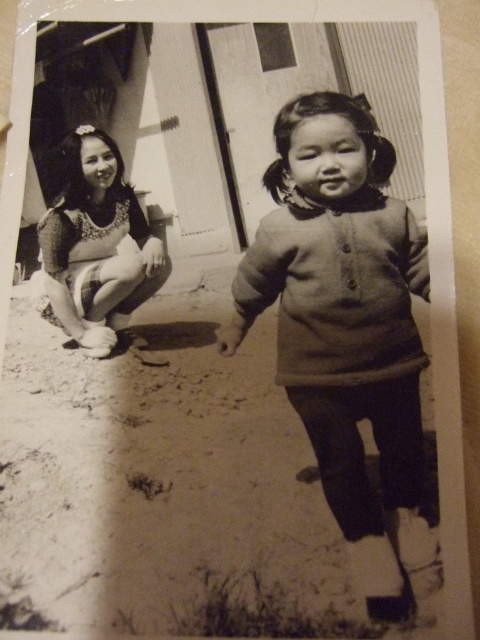
Can you confirm if dull sand at lower center is positioned above matte gray sweater at center?

Actually, dull sand at lower center is below matte gray sweater at center.

Does dull sand at lower center have a lesser height compared to matte gray sweater at center?

Indeed, dull sand at lower center has a lesser height compared to matte gray sweater at center.

Who is more distant from viewer, [72,362] or [408,378]?

The point [72,362] is more distant.

The image size is (480, 640). Find the location of `dull sand at lower center`. dull sand at lower center is located at coordinates (162, 483).

Describe the element at coordinates (162, 483) in the screenshot. The image size is (480, 640). I see `dull sand at lower center` at that location.

Can you confirm if dull sand at lower center is positioned below matte floral dress at left?

Yes.

Where is `dull sand at lower center`? dull sand at lower center is located at coordinates (162, 483).

Does matte gray sweater at center have a lesser width compared to matte floral dress at left?

No.

At what (x,y) coordinates should I click in order to perform the action: click on matte gray sweater at center. Please return your answer as a coordinate pair (x, y). Looking at the image, I should click on (346, 326).

At what (x,y) coordinates should I click in order to perform the action: click on matte gray sweater at center. Please return your answer as a coordinate pair (x, y). Looking at the image, I should click on (346, 326).